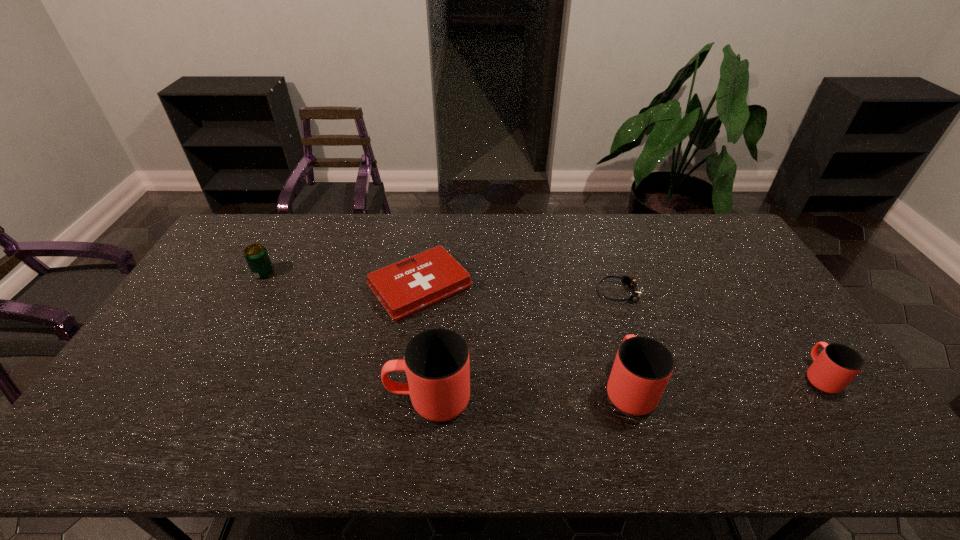
Locate an element on the screen. free spot located 0.290m through the lenses of the goggles is located at coordinates (506, 293).

Identify the location of vacant space situated 0.400m through the lenses of the goggles. (471, 293).

Where is `object located in the right edge section of the desktop`? The image size is (960, 540). object located in the right edge section of the desktop is located at coordinates (837, 365).

Find the location of a particular element. The width and height of the screenshot is (960, 540). object that is at the near right corner is located at coordinates (837, 365).

Locate an element on the screen. The height and width of the screenshot is (540, 960). vacant space at the far edge of the desktop is located at coordinates (567, 248).

Where is `vacant space at the near edge of the desktop`? vacant space at the near edge of the desktop is located at coordinates (321, 401).

The height and width of the screenshot is (540, 960). In the image, there is a desktop. What are the coordinates of `vacant space at the left edge` in the screenshot? It's located at (157, 335).

In the image, there is a desktop. Find the location of `vacant space at the far right corner`. vacant space at the far right corner is located at coordinates (704, 247).

Where is `free space between the beer can and the leftmost cup`? free space between the beer can and the leftmost cup is located at coordinates (347, 336).

Identify the location of vacant point located between the first-aid kit and the beer can. The image size is (960, 540). (342, 280).